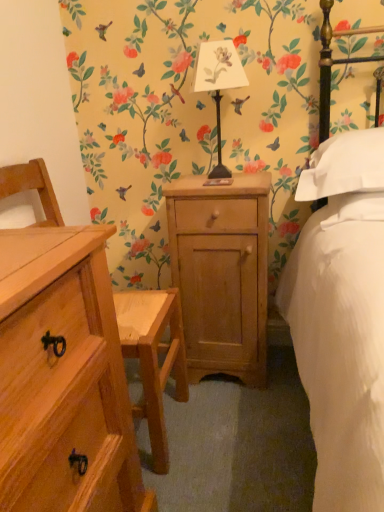
Question: Does natural wood cabinet at center contain natural wood chest of drawers at left?

Choices:
 (A) yes
 (B) no

Answer: (B)

Question: Can we say natural wood cabinet at center lies outside natural wood chest of drawers at left?

Choices:
 (A) no
 (B) yes

Answer: (B)

Question: Does natural wood cabinet at center lie in front of natural wood chest of drawers at left?

Choices:
 (A) yes
 (B) no

Answer: (B)

Question: From a real-world perspective, is natural wood cabinet at center located higher than natural wood chest of drawers at left?

Choices:
 (A) no
 (B) yes

Answer: (A)

Question: Can you confirm if natural wood cabinet at center is taller than natural wood chest of drawers at left?

Choices:
 (A) no
 (B) yes

Answer: (A)

Question: Can you confirm if natural wood cabinet at center is wider than natural wood chest of drawers at left?

Choices:
 (A) no
 (B) yes

Answer: (A)

Question: Can you confirm if metallic black lamp at center is positioned to the left of white soft pillow at right, the first pillow from the top?

Choices:
 (A) no
 (B) yes

Answer: (B)

Question: Does metallic black lamp at center have a smaller size compared to white soft pillow at right, the first pillow from the top?

Choices:
 (A) yes
 (B) no

Answer: (A)

Question: Is white soft pillow at right, the first pillow from the top, at the back of metallic black lamp at center?

Choices:
 (A) yes
 (B) no

Answer: (B)

Question: Is metallic black lamp at center closer to camera compared to white soft pillow at right, placed as the 2th pillow when sorted from bottom to top?

Choices:
 (A) yes
 (B) no

Answer: (B)

Question: From the image's perspective, is metallic black lamp at center below white soft pillow at right, the first pillow from the top?

Choices:
 (A) no
 (B) yes

Answer: (A)

Question: Considering the relative sizes of metallic black lamp at center and white soft pillow at right, placed as the 2th pillow when sorted from bottom to top, in the image provided, is metallic black lamp at center shorter than white soft pillow at right, placed as the 2th pillow when sorted from bottom to top,?

Choices:
 (A) no
 (B) yes

Answer: (A)

Question: Is natural wood cabinet at center looking in the opposite direction of white soft pillow at right, placed as the 2th pillow when sorted from bottom to top?

Choices:
 (A) no
 (B) yes

Answer: (A)